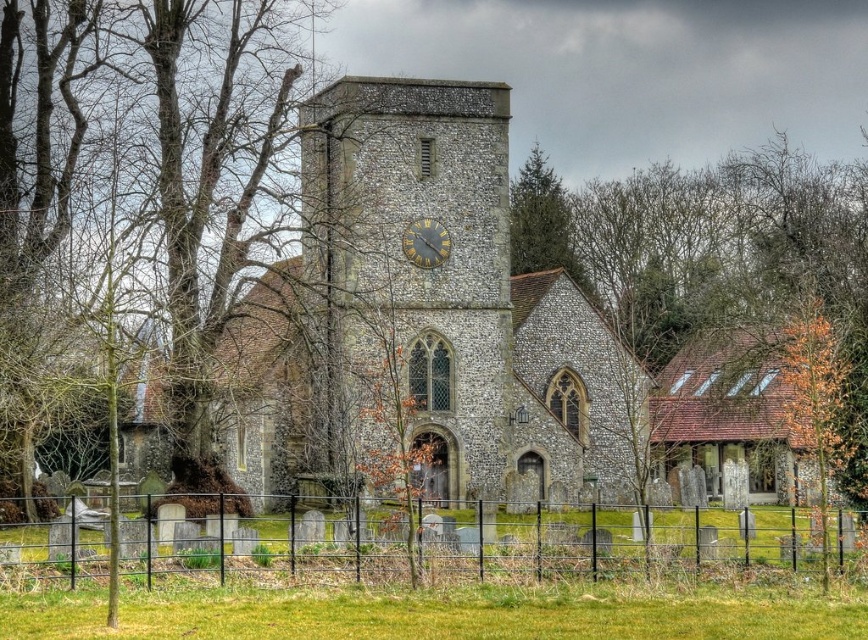
Can you confirm if stone church at center is thinner than stone clock tower at center?

Incorrect, stone church at center's width is not less than stone clock tower at center's.

Consider the image. Is stone church at center to the right of stone clock tower at center from the viewer's perspective?

Correct, you'll find stone church at center to the right of stone clock tower at center.

Which is in front, point (386, 116) or point (339, 81)?

Point (386, 116) is more forward.

This screenshot has width=868, height=640. Identify the location of stone church at center. (464, 332).

In the scene shown: Is stone clock tower at center wider than bare wood tree at center?

Incorrect, stone clock tower at center's width does not surpass bare wood tree at center's.

Describe the element at coordinates (411, 266) in the screenshot. Image resolution: width=868 pixels, height=640 pixels. I see `stone clock tower at center` at that location.

Who is more distant from viewer, (409, 296) or (5, 10)?

The point (409, 296) is behind.

Image resolution: width=868 pixels, height=640 pixels. In order to click on stone clock tower at center in this screenshot , I will do `click(411, 266)`.

Is point (504, 132) behind point (564, 253)?

No, (504, 132) is closer to viewer.

Does stone church at center have a smaller size compared to green textured pine tree at upper center?

Incorrect, stone church at center is not smaller in size than green textured pine tree at upper center.

Does point (744, 406) come farther from viewer compared to point (577, 262)?

No, (744, 406) is closer to viewer.

The width and height of the screenshot is (868, 640). In order to click on stone church at center in this screenshot , I will do `click(464, 332)`.